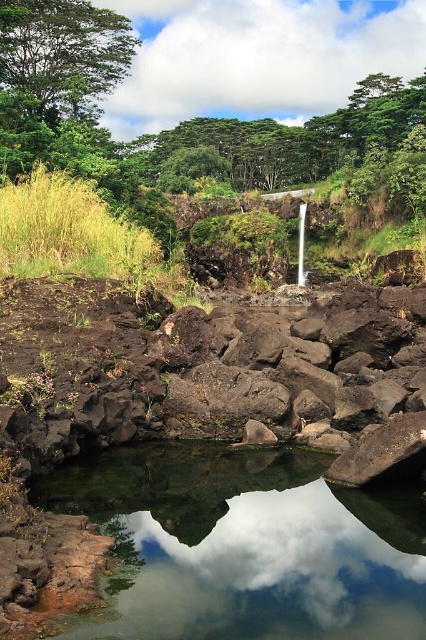
Which is in front, point (91, 500) or point (29, 109)?

Positioned in front is point (91, 500).

Can you confirm if clear water at center is wider than green leafy tree at upper left?

No.

I want to click on clear water at center, so click(245, 545).